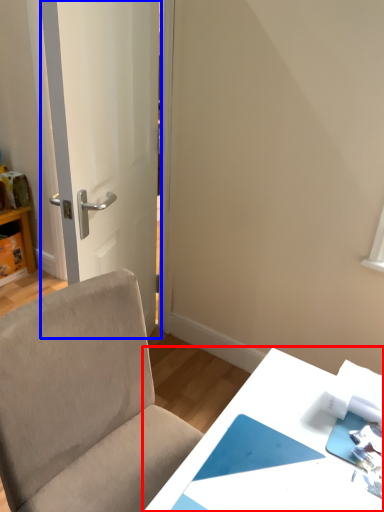
Question: Which object is further to the camera taking this photo, table (highlighted by a red box) or door (highlighted by a blue box)?

Choices:
 (A) table
 (B) door

Answer: (B)